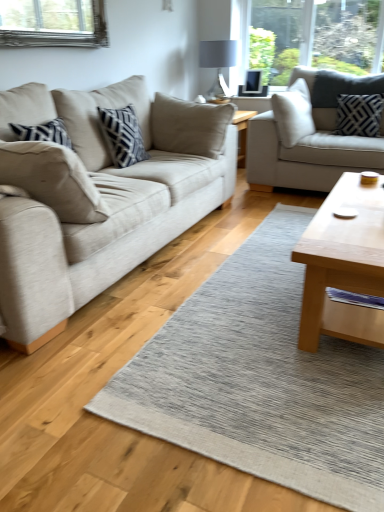
Question: In the image, is light brown wooden coffee table at center right positioned in front of or behind matte gray glass lampshade at upper center?

Choices:
 (A) behind
 (B) front

Answer: (B)

Question: From their relative heights in the image, would you say light brown wooden coffee table at center right is taller or shorter than matte gray glass lampshade at upper center?

Choices:
 (A) short
 (B) tall

Answer: (A)

Question: Based on their relative distances, which object is farther from the beige fabric pillow at left, which ranks as the second pillow in right-to-left order?

Choices:
 (A) black textured pillow at upper right, arranged as the second pillow when viewed from the left
 (B) matte gray glass lampshade at upper center
 (C) beige fabric couch at left, the first studio couch positioned from the left
 (D) light brown wooden coffee table at center right
 (E) textured gray rug at center

Answer: (B)

Question: Based on their relative distances, which object is farther from the beige fabric couch at left, the first studio couch positioned from the left?

Choices:
 (A) textured gray rug at center
 (B) beige fabric pillow at left, the 1th pillow from the left
 (C) light brown wooden coffee table at center right
 (D) light gray fabric couch at upper right, placed as the second studio couch when sorted from left to right
 (E) black textured pillow at upper right, marked as the 2th pillow in a bottom-to-top arrangement

Answer: (E)